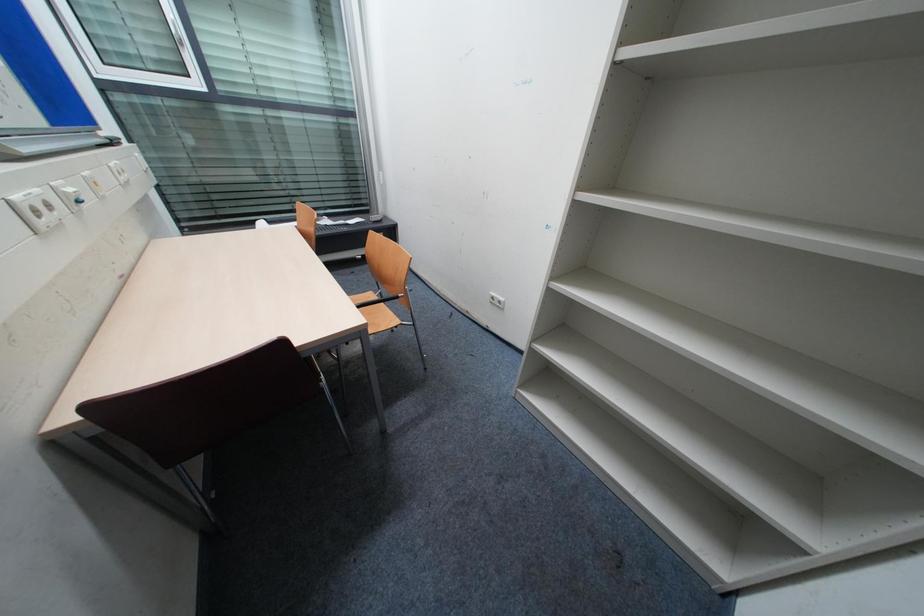
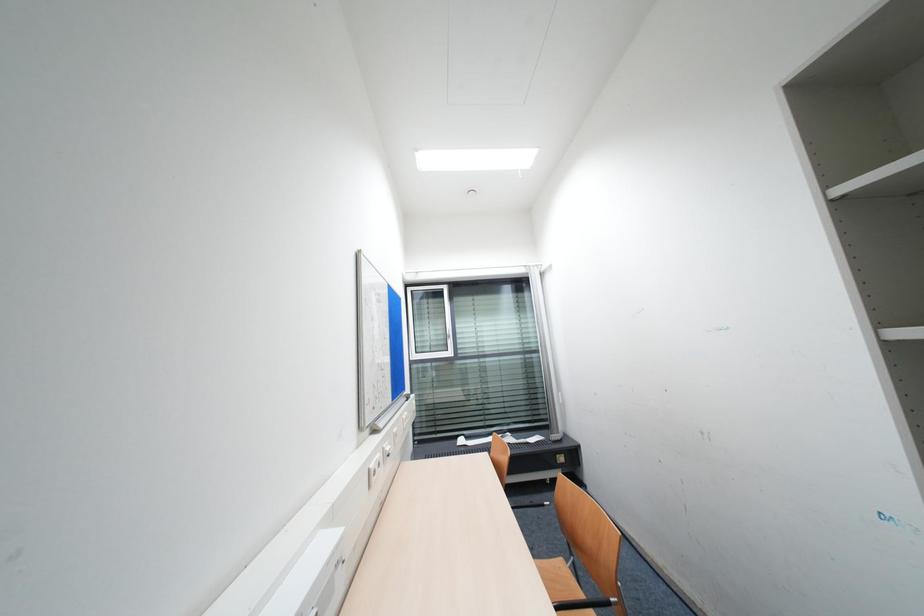
The first image is from the beginning of the video and the second image is from the end. How did the camera likely rotate when shooting the video?

The camera rotated toward left-up.